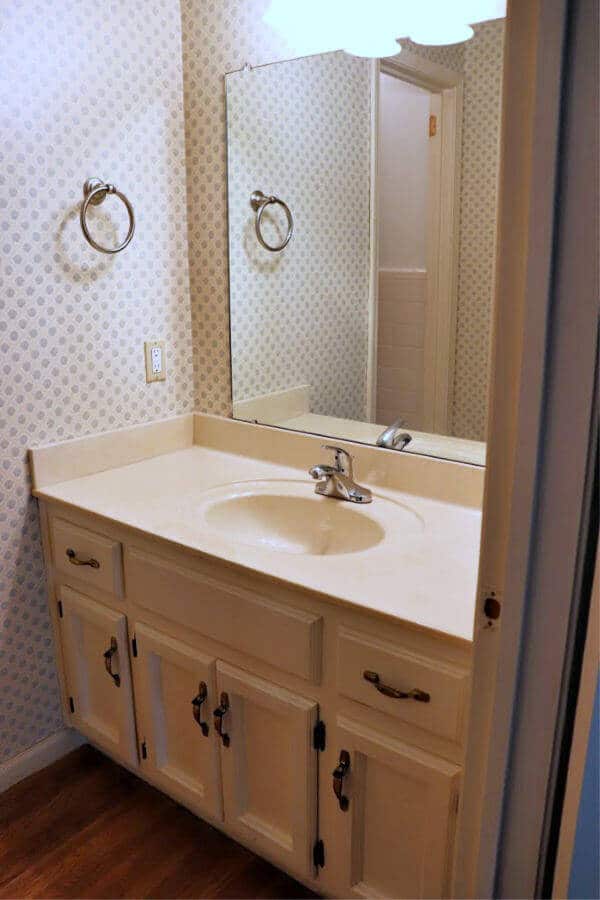
You are a GUI agent. You are given a task and a screenshot of the screen. Output one action in this format:
    pyautogui.click(x=<x>, y=<y>)
    Task: Click on the round towel holder
    The image size is (600, 900).
    Given the screenshot: What is the action you would take?
    pyautogui.click(x=112, y=248)